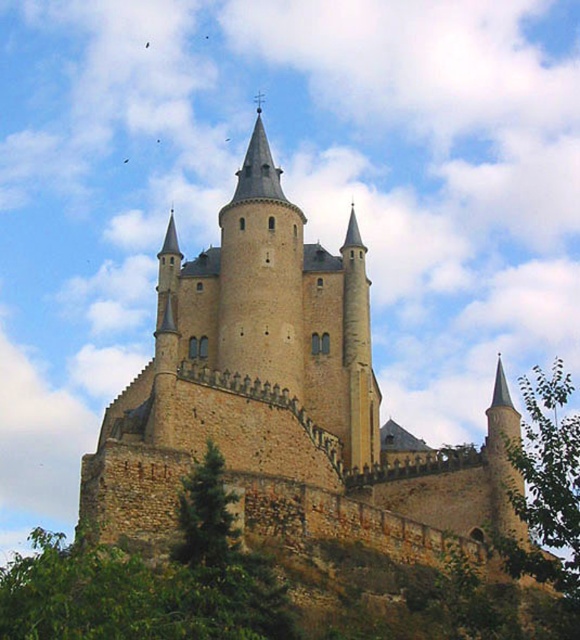
Question: Can you confirm if beige stone castle at center is positioned below green leafy tree at right?

Choices:
 (A) no
 (B) yes

Answer: (A)

Question: Does beige stone castle at center appear on the right side of green leafy tree at right?

Choices:
 (A) yes
 (B) no

Answer: (B)

Question: Which point is closer to the camera?

Choices:
 (A) (534, 500)
 (B) (165, 488)

Answer: (A)

Question: Does beige stone castle at center appear on the left side of green leafy tree at right?

Choices:
 (A) yes
 (B) no

Answer: (A)